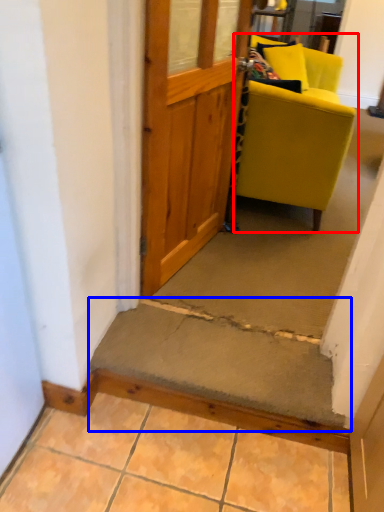
Question: Which point is further to the camera, chair (highlighted by a red box) or stairwell (highlighted by a blue box)?

Choices:
 (A) chair
 (B) stairwell

Answer: (A)